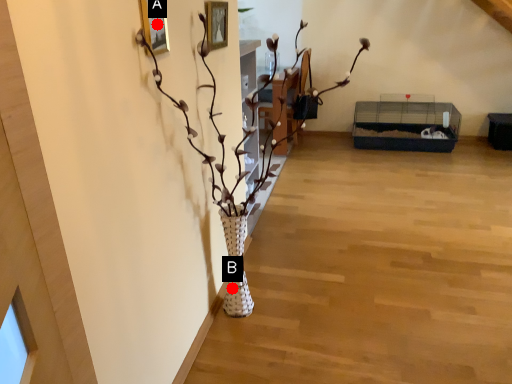
Question: Two points are circled on the image, labeled by A and B beside each circle. Which point is closer to the camera?

Choices:
 (A) A is closer
 (B) B is closer

Answer: (A)